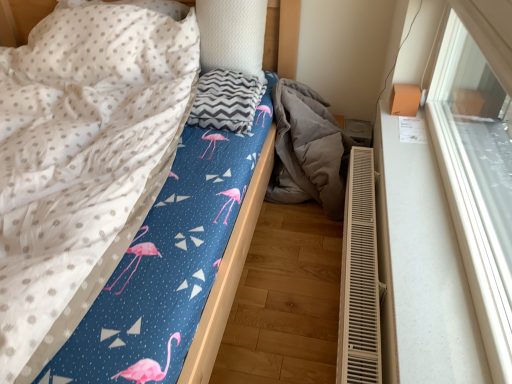
What do you see at coordinates (359, 278) in the screenshot? This screenshot has height=384, width=512. I see `white plastic radiator at lower right` at bounding box center [359, 278].

Where is `white textured pillow at upper center`? This screenshot has height=384, width=512. white textured pillow at upper center is located at coordinates click(x=232, y=35).

Is point (408, 234) positioned after point (219, 53)?

No, it is not.

Is white smooth window sill at right turned away from white textured pillow at upper center?

No, white smooth window sill at right's orientation is not away from white textured pillow at upper center.

Considering the relative positions of white smooth window sill at right and white textured pillow at upper center in the image provided, is white smooth window sill at right to the left or to the right of white textured pillow at upper center?

In the image, white smooth window sill at right appears on the right side of white textured pillow at upper center.

Is white smooth window sill at right next to white textured pillow at upper center and touching it?

No, white smooth window sill at right is not with white textured pillow at upper center.

In the scene shown: Considering the relative sizes of white textured pillow at upper center and gray chevron blanket at center in the image provided, is white textured pillow at upper center bigger than gray chevron blanket at center?

Indeed, white textured pillow at upper center has a larger size compared to gray chevron blanket at center.

Considering the positions of objects white textured pillow at upper center and gray chevron blanket at center in the image provided, who is in front, white textured pillow at upper center or gray chevron blanket at center?

gray chevron blanket at center is more forward.

From a real-world perspective, which object rests below the other?

gray chevron blanket at center, from a real-world perspective.

Considering the sizes of white textured pillow at upper center and gray chevron blanket at center in the image, is white textured pillow at upper center taller or shorter than gray chevron blanket at center?

In the image, white textured pillow at upper center appears to be taller than gray chevron blanket at center.

From the image's perspective, who appears lower, gray fabric at lower right or blue fabric bed at center?

From the image's view, blue fabric bed at center is below.

Between gray fabric at lower right and blue fabric bed at center, which one appears on the right side from the viewer's perspective?

Positioned to the right is gray fabric at lower right.

Can you tell me how much blue fabric bed at center and white glossy window sill at upper right differ in facing direction?

The facing directions of blue fabric bed at center and white glossy window sill at upper right are 90.2 degrees apart.

Does blue fabric bed at center turn towards white glossy window sill at upper right?

No, blue fabric bed at center is not aimed at white glossy window sill at upper right.

Measure the distance from blue fabric bed at center to white glossy window sill at upper right.

A distance of 30.76 inches exists between blue fabric bed at center and white glossy window sill at upper right.

Identify the location of window above the blue fabric bed at center (from the image's perspective). This screenshot has height=384, width=512. (477, 174).

From the image's perspective, which one is positioned higher, white smooth window sill at right or white glossy window sill at upper right?

white glossy window sill at upper right appears higher in the image.

Between white smooth window sill at right and white glossy window sill at upper right, which one is positioned behind?

white smooth window sill at right is further from the camera.

Can you confirm if white smooth window sill at right is thinner than white glossy window sill at upper right?

No, white smooth window sill at right is not thinner than white glossy window sill at upper right.

Considering their positions, is blue fabric bed at center located in front of or behind white textured pillow at upper center?

Visually, blue fabric bed at center is located in front of white textured pillow at upper center.

Considering the points (232, 283) and (230, 63), which point is in front, point (232, 283) or point (230, 63)?

Point (232, 283)

Is blue fabric bed at center touching white textured pillow at upper center?

No, blue fabric bed at center is not making contact with white textured pillow at upper center.

Is blue fabric bed at center facing towards white textured pillow at upper center?

No, blue fabric bed at center is not aimed at white textured pillow at upper center.

How different are the orientations of gray fabric at lower right and white smooth window sill at right in degrees?

91.4 degrees.

Is gray fabric at lower right oriented towards white smooth window sill at right?

Yes, gray fabric at lower right is aimed at white smooth window sill at right.

Is gray fabric at lower right with white smooth window sill at right?

gray fabric at lower right is not next to white smooth window sill at right, and they're not touching.

Between gray fabric at lower right and white smooth window sill at right, which one has smaller width?

white smooth window sill at right is thinner.

Locate an element on the screen. pillow above the white smooth window sill at right (from a real-world perspective) is located at coordinates (232, 35).

You are a GUI agent. You are given a task and a screenshot of the screen. Output one action in this format:
    pyautogui.click(x=<x>, y=<y>)
    Task: Click on the pillow to the right of gray chevron blanket at center
    
    Given the screenshot: What is the action you would take?
    pyautogui.click(x=232, y=35)

From the image, which object appears to be nearer to white plastic radiator at lower right, white textured pillow at upper center or gray chevron blanket at center?

Based on the image, gray chevron blanket at center appears to be nearer to white plastic radiator at lower right.

Based on their spatial positions, is gray chevron blanket at center or blue fabric bed at center further from white glossy window sill at upper right?

gray chevron blanket at center.

Looking at the image, which one is located closer to white textured pillow at upper center, blue fabric bed at center or white plastic radiator at lower right?

Based on the image, blue fabric bed at center appears to be nearer to white textured pillow at upper center.

Looking at the image, which one is located further to white smooth window sill at right, white glossy window sill at upper right or blue fabric bed at center?

The object further to white smooth window sill at right is blue fabric bed at center.

Considering their positions, is white textured pillow at upper center positioned closer to gray chevron blanket at center than white smooth window sill at right?

Among the two, white textured pillow at upper center is located nearer to gray chevron blanket at center.

When comparing their distances from white glossy window sill at upper right, does white plastic radiator at lower right or white textured pillow at upper center seem further?

white textured pillow at upper center lies further to white glossy window sill at upper right than the other object.

Based on their spatial positions, is blue fabric bed at center or white textured pillow at upper center closer to white plastic radiator at lower right?

blue fabric bed at center is closer to white plastic radiator at lower right.

When comparing their distances from white glossy window sill at upper right, does white textured pillow at upper center or white plastic radiator at lower right seem further?

white textured pillow at upper center.

Where is `window sill between blue fabric bed at center and white textured pillow at upper center in the front-back direction`? The image size is (512, 384). window sill between blue fabric bed at center and white textured pillow at upper center in the front-back direction is located at coordinates (421, 269).

You are a GUI agent. You are given a task and a screenshot of the screen. Output one action in this format:
    pyautogui.click(x=<x>, y=<y>)
    Task: Click on the blanket between white glossy window sill at upper right and gray fabric at lower right from front to back
    The height and width of the screenshot is (384, 512).
    Given the screenshot: What is the action you would take?
    pyautogui.click(x=226, y=101)

Identify the location of blanket between white smooth window sill at right and gray fabric at lower right along the z-axis. (226, 101).

Find the location of a particular element. window sill between white glossy window sill at upper right and white plastic radiator at lower right from front to back is located at coordinates (421, 269).